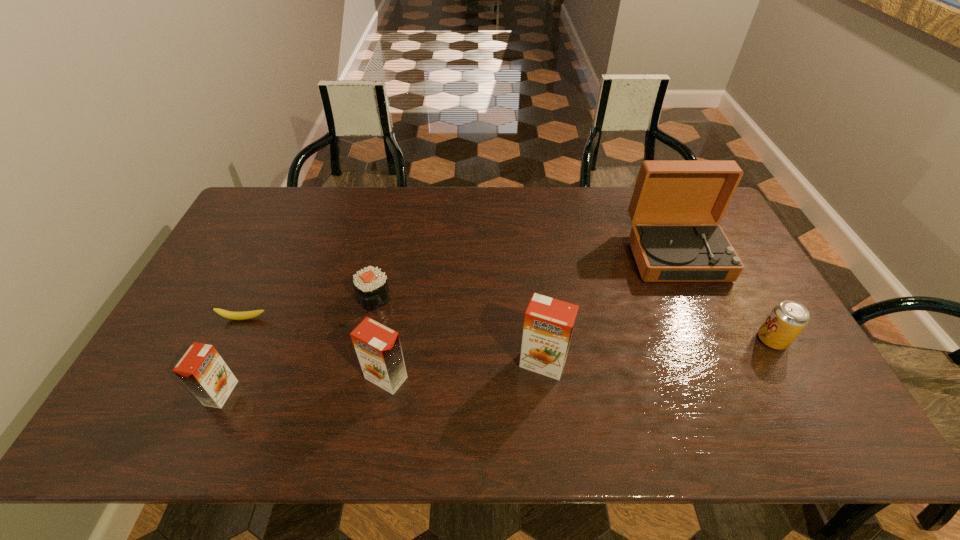
This screenshot has height=540, width=960. I want to click on vacant space that satisfies the following two spatial constraints: 1. on the upward curve of the rightmost orange juice; 2. on the right side of the shortest object, so click(223, 363).

Image resolution: width=960 pixels, height=540 pixels. What are the coordinates of `free space in the image that satisfies the following two spatial constraints: 1. on the upward curve of the banana; 2. on the left side of the fifth object from left to right` in the screenshot? It's located at (223, 363).

The width and height of the screenshot is (960, 540). I want to click on free space in the image that satisfies the following two spatial constraints: 1. on the front side of the third shortest object; 2. on the right side of the sushi, so click(x=365, y=340).

Where is `free location that satisfies the following two spatial constraints: 1. on the upward curve of the third farthest object; 2. on the left side of the fifth object from left to right`? Image resolution: width=960 pixels, height=540 pixels. free location that satisfies the following two spatial constraints: 1. on the upward curve of the third farthest object; 2. on the left side of the fifth object from left to right is located at coordinates (223, 363).